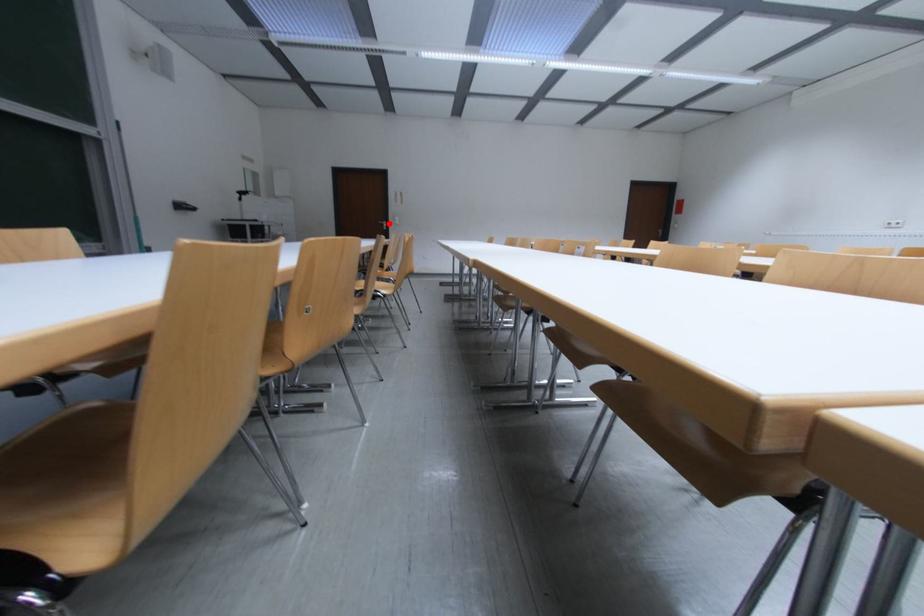
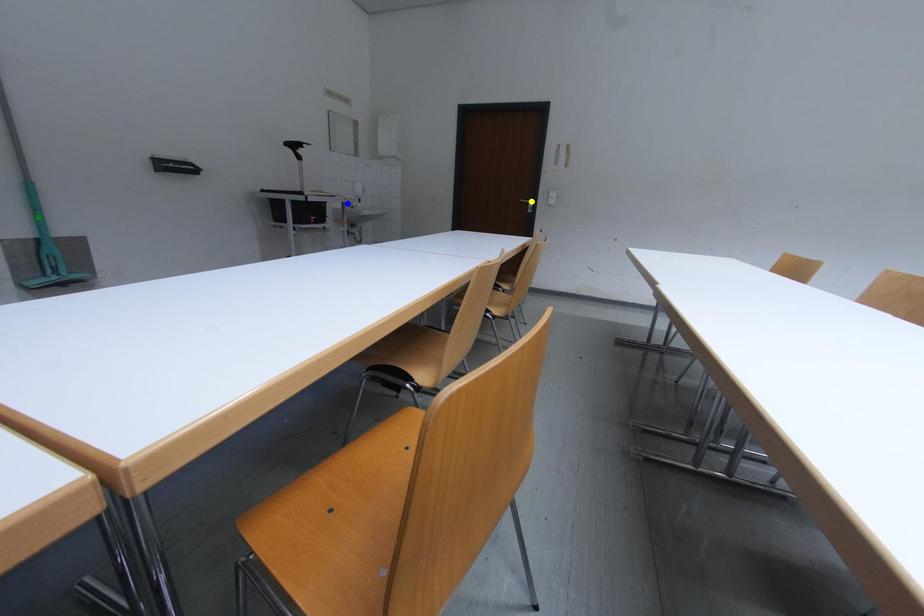
Question: I am providing you with two images of the same scene from different viewpoints. A red point is marked on the first image. You are given multiple points on the second image. Which point in image 2 is actually the same real-world point as the red point in image 1?

Choices:
 (A) blue point
 (B) yellow point
 (C) green point

Answer: (B)